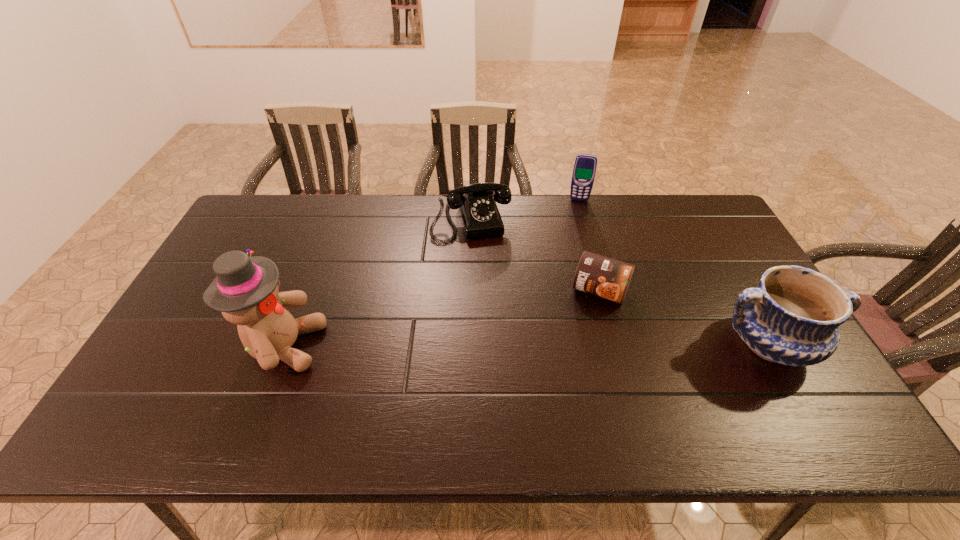
This screenshot has width=960, height=540. What are the coordinates of `vacant region between the shortest object and the rightmost object` in the screenshot? It's located at (684, 317).

Identify the location of vacant point located between the can and the pottery. (684, 317).

Identify the location of vacant area that lies between the rag_doll and the shortest object. (442, 318).

Find the location of `vacant space that's between the second shortest object and the cellular telephone`. vacant space that's between the second shortest object and the cellular telephone is located at coordinates (525, 210).

I want to click on vacant area that lies between the pottery and the can, so click(x=684, y=317).

At what (x,y) coordinates should I click in order to perform the action: click on unoccupied area between the second object from left to right and the tallest object. Please return your answer as a coordinate pair (x, y). Looking at the image, I should click on (377, 284).

Find the location of `vacant region between the can and the leftmost object`. vacant region between the can and the leftmost object is located at coordinates (442, 318).

Locate an element on the screen. The width and height of the screenshot is (960, 540). vacant area that lies between the pottery and the shortest object is located at coordinates coord(684,317).

Locate an element on the screen. This screenshot has height=540, width=960. free spot between the cellular telephone and the shortest object is located at coordinates 589,245.

Select which object is the third closest to the cellular telephone. Please provide its 2D coordinates. Your answer should be formatted as a tuple, i.e. [(x, y)], where the tuple contains the x and y coordinates of a point satisfying the conditions above.

[(792, 318)]